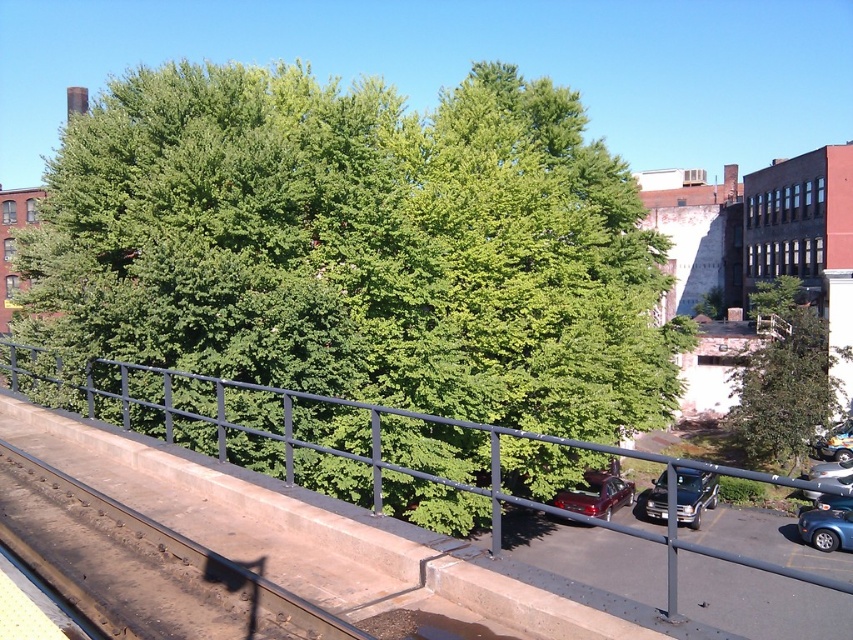
Question: Can you confirm if black metal/rail at center is wider than glossy metallic car at lower right?

Choices:
 (A) no
 (B) yes

Answer: (B)

Question: Does shiny black suv at lower right have a greater width compared to shiny blue sedan at lower right?

Choices:
 (A) yes
 (B) no

Answer: (A)

Question: Which point appears farthest from the camera in this image?

Choices:
 (A) (711, 483)
 (B) (631, 492)

Answer: (B)

Question: Which of the following is the closest to the observer?

Choices:
 (A) (584, 483)
 (B) (845, 476)
 (C) (126, 406)

Answer: (C)

Question: Which object appears closest to the camera in this image?

Choices:
 (A) black metal/rail at center
 (B) brown concrete train track at center
 (C) metallic silver car at lower right
 (D) shiny black suv at lower right

Answer: (A)

Question: Is metallic blue car at lower right smaller than metallic silver car at lower right?

Choices:
 (A) no
 (B) yes

Answer: (B)